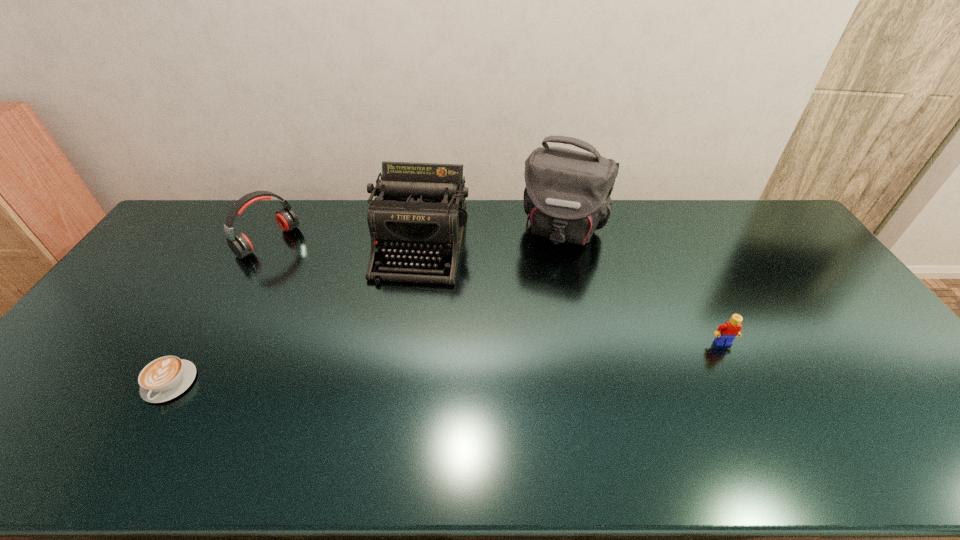
Where is `the nearest object`? This screenshot has width=960, height=540. the nearest object is located at coordinates (163, 379).

Where is `cappuccino`? cappuccino is located at coordinates (163, 379).

Image resolution: width=960 pixels, height=540 pixels. Find the location of `Lego`. Lego is located at coordinates (726, 333).

Find the location of a particular element. This screenshot has width=960, height=540. the fourth tallest object is located at coordinates (726, 333).

Identify the location of the fourth shortest object. The image size is (960, 540). click(x=419, y=211).

You are a GUI agent. You are given a task and a screenshot of the screen. Output one action in this format:
    pyautogui.click(x=<x>, y=<y>)
    Task: Click on the third object from left to right
    This screenshot has height=540, width=960.
    Given the screenshot: What is the action you would take?
    pyautogui.click(x=419, y=211)

Find the location of a particular element. Image resolution: width=960 pixels, height=540 pixels. the third tallest object is located at coordinates (239, 243).

You are a GUI agent. You are given a task and a screenshot of the screen. Output one action in this format:
    pyautogui.click(x=<x>, y=<y>)
    Task: Click on the shoulder bag
    This screenshot has height=540, width=960.
    Given the screenshot: What is the action you would take?
    pyautogui.click(x=567, y=197)

At what (x,y) coordinates should I click in order to perform the action: click on the fourth object from left to right. Please return your answer as a coordinate pair (x, y). The width and height of the screenshot is (960, 540). Looking at the image, I should click on (567, 197).

I want to click on vacant area situated on the keyboard of the fourth shortest object, so click(405, 308).